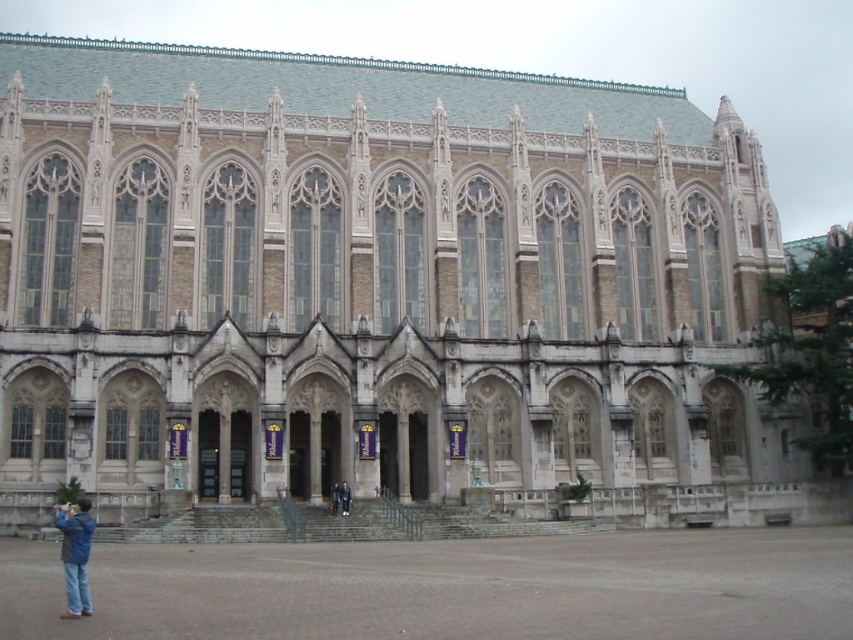
Is point (62, 531) in front of point (337, 502)?

That is True.

Does blue denim jacket at lower left appear under dark blue jacket at center?

Incorrect, blue denim jacket at lower left is not positioned below dark blue jacket at center.

Describe the element at coordinates (74, 554) in the screenshot. I see `blue denim jacket at lower left` at that location.

Where is `blue denim jacket at lower left`? This screenshot has height=640, width=853. blue denim jacket at lower left is located at coordinates (74, 554).

Is dark blue jeans at lower center further to camera compared to dark blue jacket at center?

No, it is not.

Is dark blue jeans at lower center bigger than dark blue jacket at center?

Yes, dark blue jeans at lower center is bigger than dark blue jacket at center.

Is point (346, 493) more distant than point (332, 508)?

Yes, point (346, 493) is behind point (332, 508).

In order to click on dark blue jeans at lower center in this screenshot , I will do `click(344, 497)`.

Does blue denim jacket at lower left appear over dark blue jeans at lower center?

Correct, blue denim jacket at lower left is located above dark blue jeans at lower center.

Is point (78, 604) farther from viewer compared to point (339, 496)?

No, it is in front of (339, 496).

Where is `blue denim jacket at lower left`? blue denim jacket at lower left is located at coordinates (74, 554).